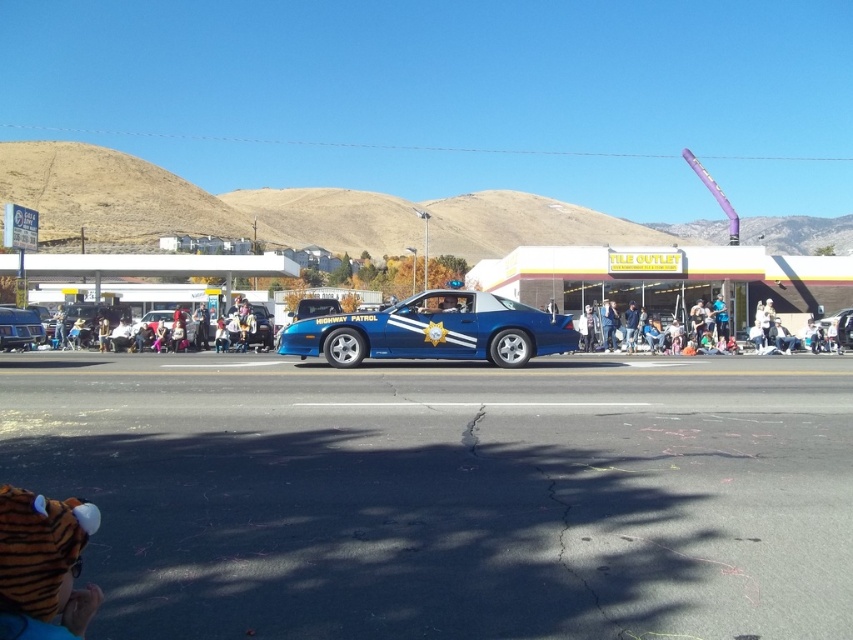
From the picture: You are a photographer standing at the edge of the street. You want to take a photo of both the shiny blue car at center and the tiger costume at lower left. However, you notice that one of them is taller than the other. Which object should you position closer to the camera to ensure both are fully visible in the frame?

The shiny blue car at center is taller than the tiger costume at lower left. To ensure both are fully visible in the frame, you should position the tiger costume at lower left closer to the camera since it is shorter and can be brought into focus without the taller shiny blue car at center blocking its view.

You are a photographer standing in the crowd. You want to take a photo of both the blue glossy jacket at center and the blue glossy uniform at center. Which object should you focus on first to ensure it appears in the foreground of your photo?

The blue glossy jacket at center is much taller than the blue glossy uniform at center, so you should focus on the blue glossy jacket at center first to ensure it appears in the foreground.

You are standing at the point marked by the coordinates point (630, 324). Looking around, you see the blue glossy jacket at center. Which direction should you face to see the blue police car labeled Highway Patrol?

The blue glossy jacket at center is located at point (630, 324). Since the blue police car labeled Highway Patrol is in the foreground, you should face forward to see it.